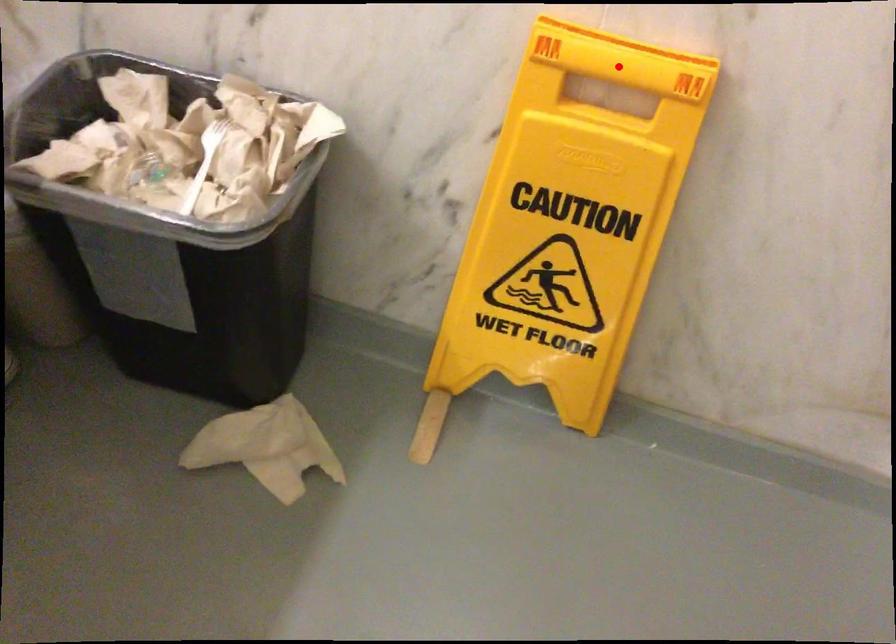
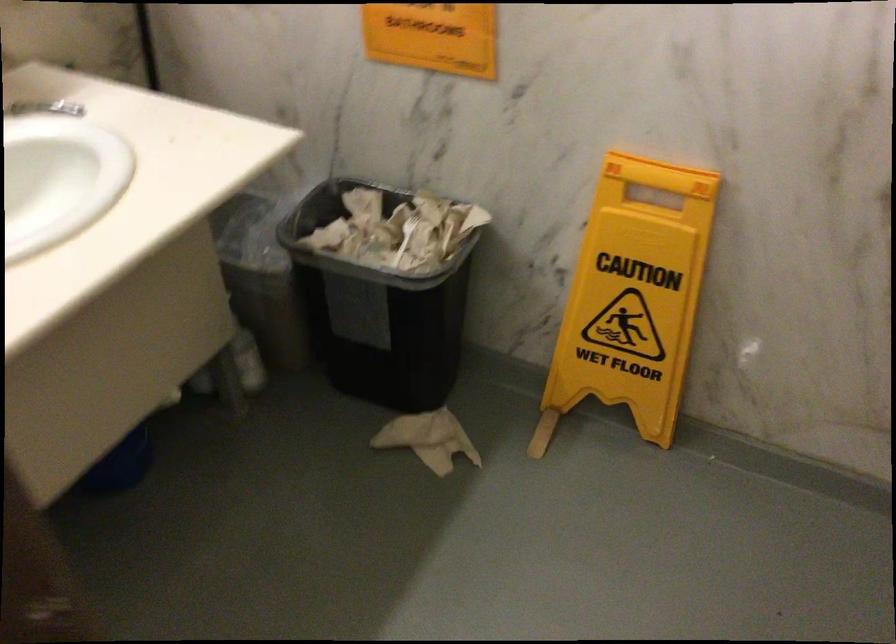
Question: I am providing you with two images of the same scene from different viewpoints. In image1, a red point is highlighted. Considering the same 3D point in image2, which of the following is correct?

Choices:
 (A) It is closer
 (B) It is farther

Answer: (B)